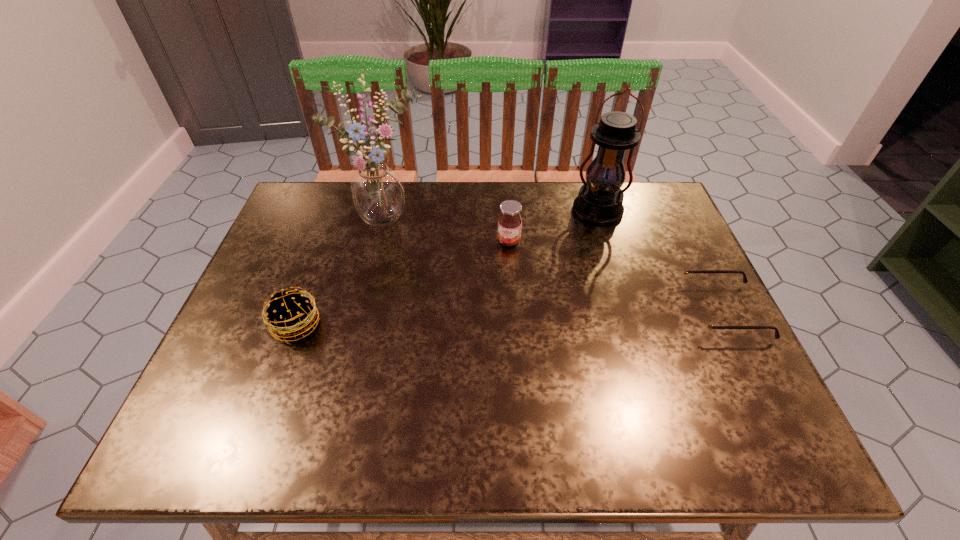
At what (x,y) coordinates should I click in order to perform the action: click on vacant space at the near edge of the desktop. Please return your answer as a coordinate pair (x, y). This screenshot has height=540, width=960. Looking at the image, I should click on (364, 381).

You are a GUI agent. You are given a task and a screenshot of the screen. Output one action in this format:
    pyautogui.click(x=<x>, y=<y>)
    Task: Click on the free space at the left edge
    This screenshot has width=960, height=540.
    Given the screenshot: What is the action you would take?
    pyautogui.click(x=310, y=257)

Identify the location of vacant space at the far left corner of the desktop. (329, 198).

The width and height of the screenshot is (960, 540). I want to click on free space at the far right corner, so click(x=626, y=221).

I want to click on empty location between the shortest object and the patty, so click(510, 318).

The height and width of the screenshot is (540, 960). What are the coordinates of `unoccupied area between the lantern and the patty` in the screenshot? It's located at (447, 268).

This screenshot has height=540, width=960. Find the location of `free space between the shortest object and the lantern`. free space between the shortest object and the lantern is located at coordinates (660, 261).

Find the location of a particular element. The width and height of the screenshot is (960, 540). blank region between the shortest object and the patty is located at coordinates (510, 318).

At what (x,y) coordinates should I click in order to perform the action: click on vacant space that's between the second tallest object and the shortest object. Please return your answer as a coordinate pair (x, y). The height and width of the screenshot is (540, 960). Looking at the image, I should click on (660, 261).

This screenshot has height=540, width=960. In order to click on free space between the lantern and the patty in this screenshot , I will do `click(447, 268)`.